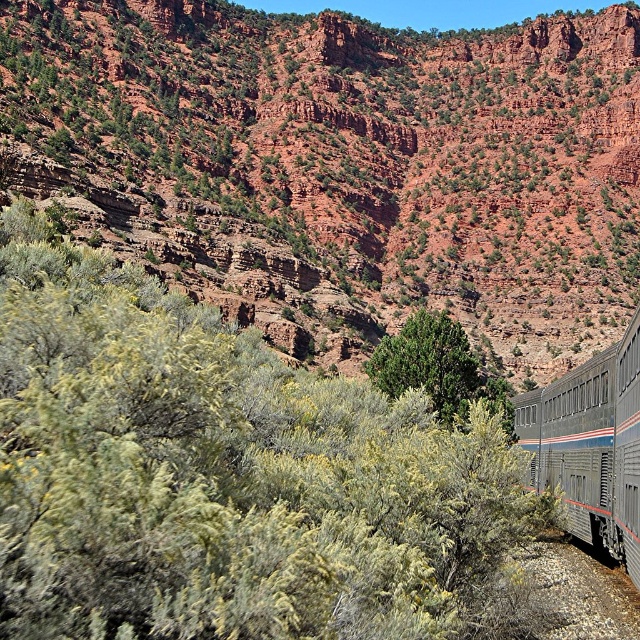
How far apart are metallic silver train at right and green matte tree at center?

metallic silver train at right is 37.80 feet from green matte tree at center.

Does metallic silver train at right have a larger size compared to green matte tree at center?

Yes, metallic silver train at right is bigger than green matte tree at center.

Does point (529, 474) lie in front of point (449, 422)?

No, it is not.

You are a GUI agent. You are given a task and a screenshot of the screen. Output one action in this format:
    pyautogui.click(x=<x>, y=<y>)
    Task: Click on the metallic silver train at right
    The height and width of the screenshot is (640, 640).
    Given the screenshot: What is the action you would take?
    pyautogui.click(x=589, y=445)

Which is more to the right, green leafy bush at center or metallic silver train at right?

From the viewer's perspective, metallic silver train at right appears more on the right side.

Locate an element on the screen. green leafy bush at center is located at coordinates (228, 477).

Locate an element on the screen. Image resolution: width=640 pixels, height=640 pixels. green leafy bush at center is located at coordinates (228, 477).

From the picture: Is green leafy bush at center positioned at the back of green matte tree at center?

That is False.

Which is above, green leafy bush at center or green matte tree at center?

green leafy bush at center is above.

You are a GUI agent. You are given a task and a screenshot of the screen. Output one action in this format:
    pyautogui.click(x=<x>, y=<y>)
    Task: Click on the green leafy bush at center
    This screenshot has height=640, width=640.
    Given the screenshot: What is the action you would take?
    pyautogui.click(x=228, y=477)